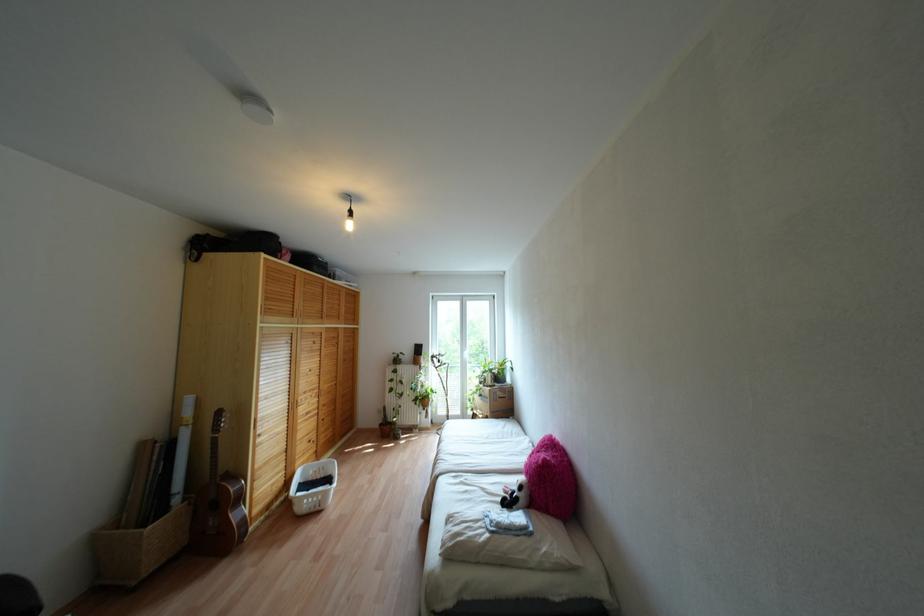
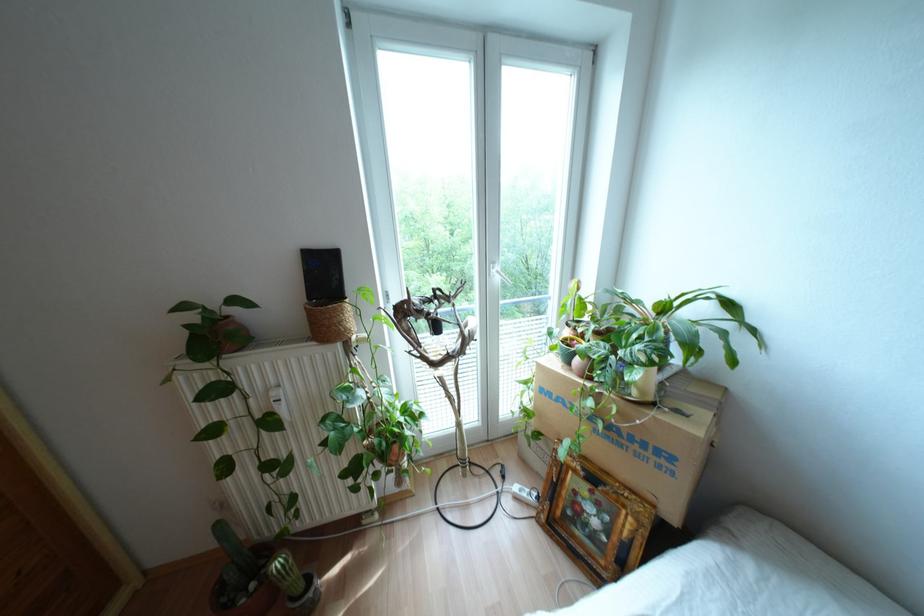
Question: What movement of the cameraman would produce the second image?

Choices:
 (A) Left
 (B) Right
 (C) Forward
 (D) Backward

Answer: (C)